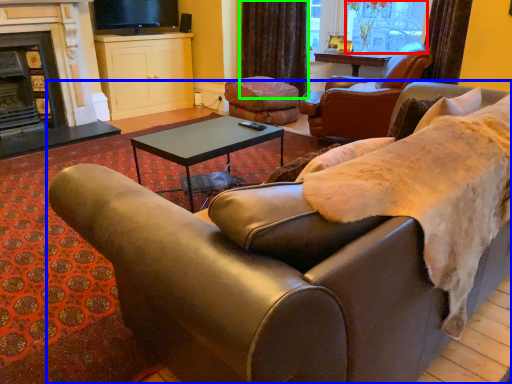
Question: Which is farther away from window screen (highlighted by a red box)? studio couch (highlighted by a blue box) or curtain (highlighted by a green box)?

Choices:
 (A) studio couch
 (B) curtain

Answer: (A)